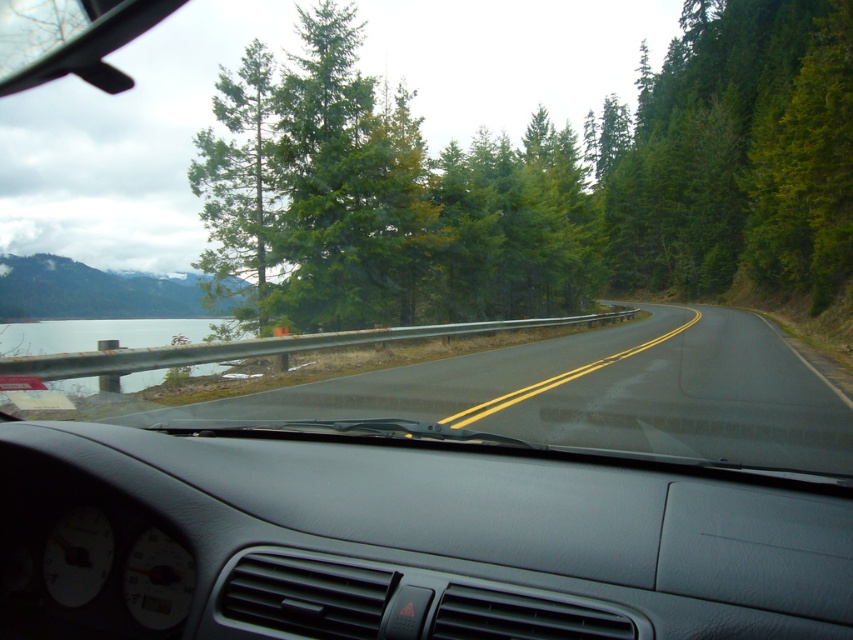
Question: Is black asphalt road at center to the right of clear glass water at left from the viewer's perspective?

Choices:
 (A) no
 (B) yes

Answer: (B)

Question: Among these points, which one is farthest from the camera?

Choices:
 (A) [x=260, y=400]
 (B) [x=189, y=177]
 (C) [x=61, y=381]
 (D) [x=523, y=173]

Answer: (D)

Question: Is green textured tree at center to the left of black asphalt road at center from the viewer's perspective?

Choices:
 (A) yes
 (B) no

Answer: (B)

Question: Which point appears closest to the camera in this image?

Choices:
 (A) (171, 330)
 (B) (200, 268)
 (C) (578, 276)

Answer: (B)

Question: Can you confirm if green textured tree at center is smaller than clear glass water at left?

Choices:
 (A) yes
 (B) no

Answer: (B)

Question: Among these objects, which one is nearest to the camera?

Choices:
 (A) black asphalt road at center
 (B) clear glass water at left
 (C) green textured pine tree at upper center
 (D) green textured tree at center

Answer: (A)